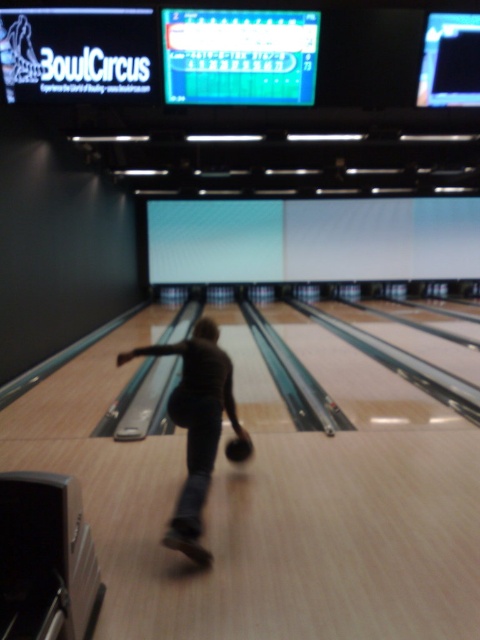
Question: In this image, where is dark brown leather bowling ball at center located relative to black matte bowling ball at center?

Choices:
 (A) above
 (B) below

Answer: (A)

Question: Is the position of dark brown leather bowling ball at center less distant than that of black matte bowling ball at center?

Choices:
 (A) no
 (B) yes

Answer: (B)

Question: Which of the following is the closest to the observer?

Choices:
 (A) dark brown leather bowling ball at center
 (B) black matte bowling ball at center

Answer: (A)

Question: Which point is closer to the camera?

Choices:
 (A) black matte bowling ball at center
 (B) dark brown leather bowling ball at center

Answer: (B)

Question: Is dark brown leather bowling ball at center to the right of black matte bowling ball at center from the viewer's perspective?

Choices:
 (A) no
 (B) yes

Answer: (A)